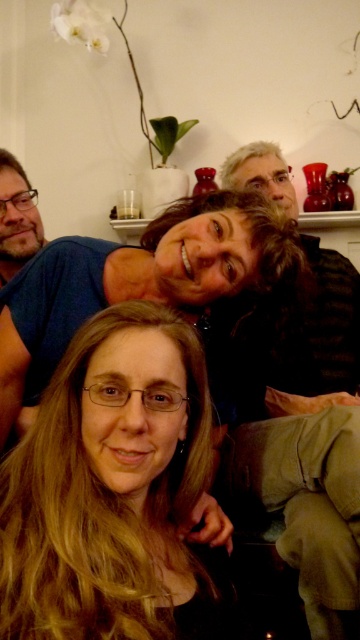
Based on the scene description, where is the blonde hair at center in relation to the matte black hair at lower left?

The blonde hair at center is below the matte black hair at lower left.

You are standing in the living room and want to place a small plant between the two points labeled as point (320, 492) and point (47, 340). Which point should the plant be closer to in order to be closer to you?

The plant should be closer to point (320, 492) because it is closer to the viewer than point (47, 340).

You are standing in the living room and see the point marked at coordinates (105, 497). Which object in the scene does this point correspond to?

The point at coordinates (105, 497) corresponds to the blonde hair at center.